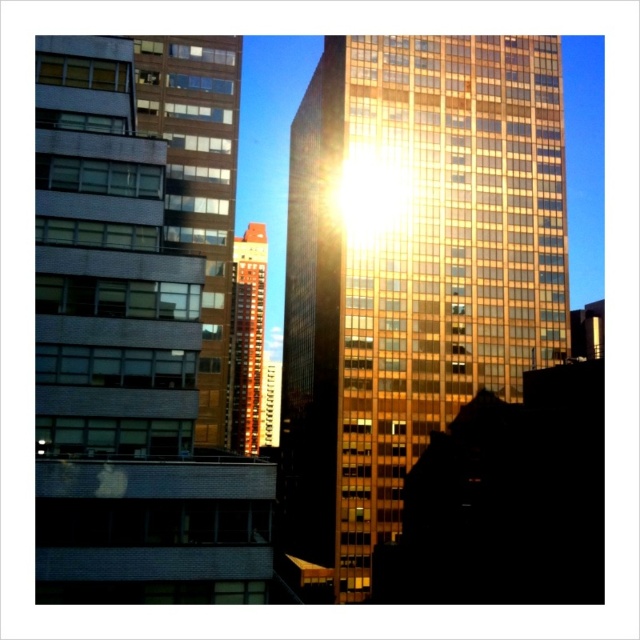
Question: Does gold reflective glass building at center appear over brown brick building at center?

Choices:
 (A) no
 (B) yes

Answer: (B)

Question: Which object is closer to the camera taking this photo?

Choices:
 (A) brown glass building at upper left
 (B) brown brick building at center
 (C) gold reflective glass building at center

Answer: (A)

Question: Can you confirm if gold reflective glass building at center is thinner than brown brick building at center?

Choices:
 (A) yes
 (B) no

Answer: (B)

Question: Is gold reflective glass building at center below brown glass building at upper left?

Choices:
 (A) yes
 (B) no

Answer: (B)

Question: Which point is closer to the camera taking this photo?

Choices:
 (A) (236, 342)
 (B) (352, 288)
 (C) (173, 241)

Answer: (C)

Question: Which of the following is the farthest from the observer?

Choices:
 (A) (356, 92)
 (B) (172, 157)
 (C) (237, 376)

Answer: (C)